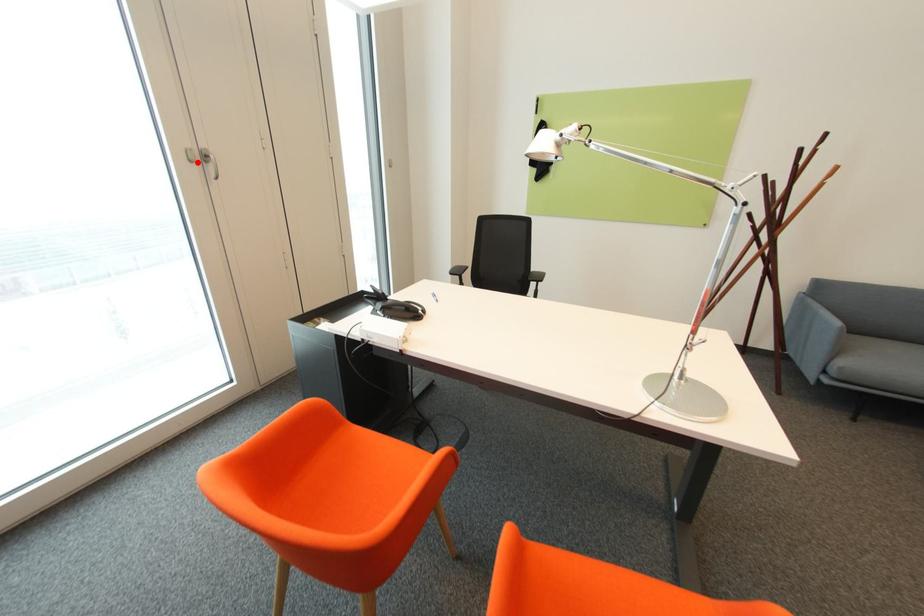
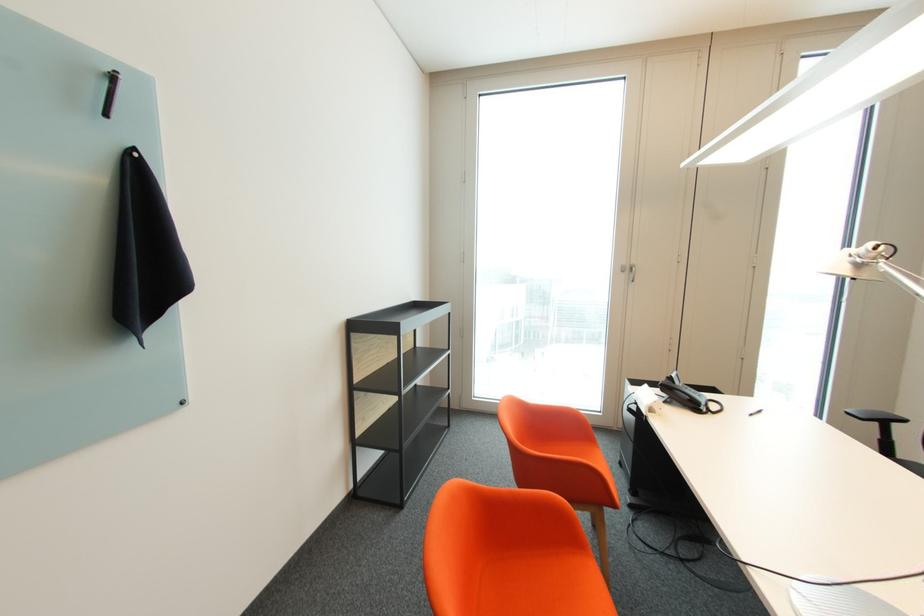
In the second image, find the point that corresponds to the highlighted location in the first image.

(629, 272)